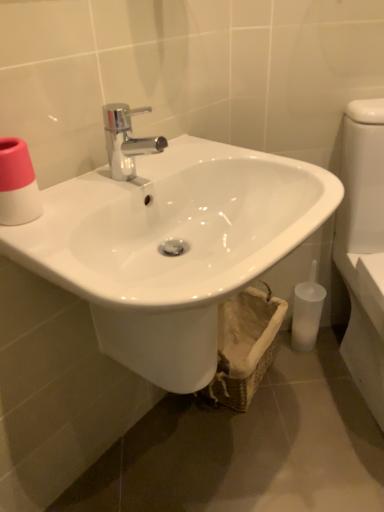
Locate an element on the screen. This screenshot has height=512, width=384. translucent plastic toilet brush at lower right is located at coordinates (307, 312).

Find the location of a particular element. The height and width of the screenshot is (512, 384). white glossy toilet at right is located at coordinates (363, 247).

Describe the element at coordinates (363, 247) in the screenshot. I see `white glossy toilet at right` at that location.

Locate an element on the screen. The width and height of the screenshot is (384, 512). pink matte toilet paper at upper left is located at coordinates (17, 184).

Is woven beige basket at lower center bigger than pink matte toilet paper at upper left?

Yes.

Between woven beige basket at lower center and pink matte toilet paper at upper left, which one is positioned in front?

pink matte toilet paper at upper left.

Can you confirm if woven beige basket at lower center is thinner than pink matte toilet paper at upper left?

In fact, woven beige basket at lower center might be wider than pink matte toilet paper at upper left.

Can you confirm if pink matte toilet paper at upper left is bigger than translucent plastic toilet brush at lower right?

Incorrect, pink matte toilet paper at upper left is not larger than translucent plastic toilet brush at lower right.

From a real-world perspective, is pink matte toilet paper at upper left positioned above or below translucent plastic toilet brush at lower right?

pink matte toilet paper at upper left is above translucent plastic toilet brush at lower right.

From the picture: Is translucent plastic toilet brush at lower right surrounded by pink matte toilet paper at upper left?

No.

Can you confirm if pink matte toilet paper at upper left is shorter than translucent plastic toilet brush at lower right?

Indeed, pink matte toilet paper at upper left has a lesser height compared to translucent plastic toilet brush at lower right.

Is translucent plastic toilet brush at lower right bigger or smaller than pink matte toilet paper at upper left?

Clearly, translucent plastic toilet brush at lower right is larger in size than pink matte toilet paper at upper left.

From the picture: From a real-world perspective, is translucent plastic toilet brush at lower right above or below pink matte toilet paper at upper left?

Clearly, from a real-world perspective, translucent plastic toilet brush at lower right is below pink matte toilet paper at upper left.

Image resolution: width=384 pixels, height=512 pixels. What are the coordinates of `toiletry below the pink matte toilet paper at upper left (from a real-world perspective)` in the screenshot? It's located at (307, 312).

Is translucent plastic toilet brush at lower right facing away from pink matte toilet paper at upper left?

No, pink matte toilet paper at upper left is not at the back of translucent plastic toilet brush at lower right.

Which object is further away from the camera, white glossy toilet at right or translucent plastic toilet brush at lower right?

translucent plastic toilet brush at lower right is further away from the camera.

What are the coordinates of `porcelain lying above the translucent plastic toilet brush at lower right (from the image's perspective)` in the screenshot? It's located at (363, 247).

Would you say white glossy toilet at right contains translucent plastic toilet brush at lower right?

That's incorrect, translucent plastic toilet brush at lower right is not inside white glossy toilet at right.

Between woven beige basket at lower center and white glossy toilet at right, which one has less height?

woven beige basket at lower center.

Which is in front, point (237, 384) or point (343, 158)?

The point (343, 158) is more forward.

Is woven beige basket at lower center oriented away from white glossy toilet at right?

No, woven beige basket at lower center is not facing away from white glossy toilet at right.

Between woven beige basket at lower center and white glossy toilet at right, which one has smaller width?

woven beige basket at lower center.

Is white glossy sink at center taller than white glossy toilet at right?

No, white glossy sink at center is not taller than white glossy toilet at right.

In the scene shown: Considering the sizes of white glossy sink at center and white glossy toilet at right in the image, is white glossy sink at center bigger or smaller than white glossy toilet at right?

In the image, white glossy sink at center appears to be smaller than white glossy toilet at right.

Is white glossy sink at center not inside white glossy toilet at right?

Yes, white glossy sink at center is not within white glossy toilet at right.

From a real-world perspective, is white glossy sink at center under white glossy toilet at right?

No.

Is point (292, 343) closer or farther from the camera than point (81, 199)?

Point (292, 343).

Based on the photo, in terms of width, does translucent plastic toilet brush at lower right look wider or thinner when compared to white glossy sink at center?

translucent plastic toilet brush at lower right is thinner than white glossy sink at center.

In the scene shown: From a real-world perspective, which object rests below the other?

From a 3D spatial view, translucent plastic toilet brush at lower right is below.

Who is taller, translucent plastic toilet brush at lower right or white glossy sink at center?

white glossy sink at center is taller.

What are the coordinates of `toilet paper lying on the left of woven beige basket at lower center` in the screenshot? It's located at (17, 184).

Where is `toilet paper in front of the translucent plastic toilet brush at lower right`? Image resolution: width=384 pixels, height=512 pixels. toilet paper in front of the translucent plastic toilet brush at lower right is located at coordinates (17, 184).

Looking at the image, which one is located closer to pink matte toilet paper at upper left, white glossy toilet at right or woven beige basket at lower center?

woven beige basket at lower center lies closer to pink matte toilet paper at upper left than the other object.

Looking at the image, which one is located closer to woven beige basket at lower center, white glossy sink at center or white glossy toilet at right?

white glossy toilet at right is closer to woven beige basket at lower center.

Based on their spatial positions, is translucent plastic toilet brush at lower right or pink matte toilet paper at upper left further from white glossy sink at center?

translucent plastic toilet brush at lower right is positioned further to the anchor white glossy sink at center.

From the image, which object appears to be nearer to pink matte toilet paper at upper left, white glossy toilet at right or white glossy sink at center?

white glossy sink at center is positioned closer to the anchor pink matte toilet paper at upper left.

Considering their positions, is white glossy sink at center positioned further to translucent plastic toilet brush at lower right than woven beige basket at lower center?

Based on the image, white glossy sink at center appears to be further to translucent plastic toilet brush at lower right.

Estimate the real-world distances between objects in this image. Which object is further from white glossy toilet at right, pink matte toilet paper at upper left or translucent plastic toilet brush at lower right?

Based on the image, pink matte toilet paper at upper left appears to be further to white glossy toilet at right.

Considering their positions, is translucent plastic toilet brush at lower right positioned further to white glossy toilet at right than white glossy sink at center?

white glossy sink at center lies further to white glossy toilet at right than the other object.

Looking at the image, which one is located closer to white glossy sink at center, pink matte toilet paper at upper left or woven beige basket at lower center?

pink matte toilet paper at upper left is positioned closer to the anchor white glossy sink at center.

Where is `toiletry between pink matte toilet paper at upper left and white glossy toilet at right from left to right`? The image size is (384, 512). toiletry between pink matte toilet paper at upper left and white glossy toilet at right from left to right is located at coordinates [307, 312].

Identify the location of basket between white glossy toilet at right and translucent plastic toilet brush at lower right along the z-axis. (244, 346).

At what (x,y) coordinates should I click in order to perform the action: click on basket located between white glossy sink at center and translucent plastic toilet brush at lower right in the depth direction. Please return your answer as a coordinate pair (x, y). Looking at the image, I should click on (244, 346).

Locate an element on the screen. This screenshot has height=512, width=384. toilet paper located between white glossy sink at center and woven beige basket at lower center in the depth direction is located at coordinates (17, 184).